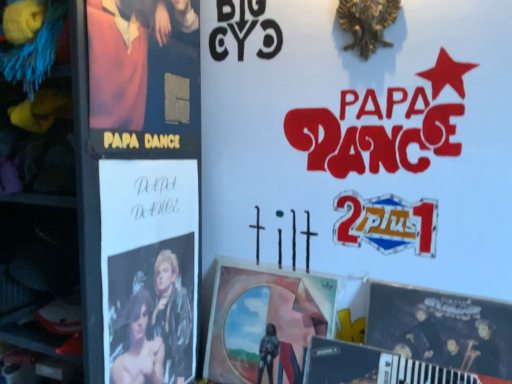
Question: In which direction should I rotate to look at matte paper poster at center, the second poster positioned from the left?

Choices:
 (A) right
 (B) left

Answer: (A)

Question: Is the depth of matte paper poster at center, the second poster positioned from the left, less than that of matte black poster at lower right, which ranks as the first poster in right-to-left order?

Choices:
 (A) no
 (B) yes

Answer: (A)

Question: Does matte paper poster at center, the second poster positioned from the left, have a greater width compared to matte black poster at lower right, which ranks as the first poster in right-to-left order?

Choices:
 (A) yes
 (B) no

Answer: (A)

Question: Could you tell me if matte paper poster at center, the 2th poster in the right-to-left sequence, is facing matte black poster at lower right, which ranks as the first poster in right-to-left order?

Choices:
 (A) no
 (B) yes

Answer: (A)

Question: Is matte black poster at lower right, which ranks as the first poster in right-to-left order, at the back of matte paper poster at center, the second poster positioned from the left?

Choices:
 (A) no
 (B) yes

Answer: (A)

Question: From the image's perspective, is matte paper poster at center, the 2th poster in the right-to-left sequence, located beneath matte black poster at lower right, which ranks as the first poster in right-to-left order?

Choices:
 (A) yes
 (B) no

Answer: (A)

Question: Would you consider matte paper poster at center, the second poster positioned from the left, to be distant from matte black poster at lower right, which is the third poster from left to right?

Choices:
 (A) no
 (B) yes

Answer: (A)

Question: From a real-world perspective, is matte paper poster at center, the second poster positioned from the left, under metallic silver magazine at lower right?

Choices:
 (A) no
 (B) yes

Answer: (A)

Question: Does matte paper poster at center, the 2th poster in the right-to-left sequence, have a lesser width compared to metallic silver magazine at lower right?

Choices:
 (A) yes
 (B) no

Answer: (B)

Question: Is matte paper poster at center, the second poster positioned from the left, taller than metallic silver magazine at lower right?

Choices:
 (A) no
 (B) yes

Answer: (B)

Question: Is matte paper poster at center, the second poster positioned from the left, positioned in front of metallic silver magazine at lower right?

Choices:
 (A) no
 (B) yes

Answer: (A)

Question: Is metallic silver magazine at lower right located within matte paper poster at center, the 2th poster in the right-to-left sequence?

Choices:
 (A) yes
 (B) no

Answer: (B)

Question: From a real-world perspective, is matte paper poster at center, the 2th poster in the right-to-left sequence, positioned over metallic silver magazine at lower right based on gravity?

Choices:
 (A) no
 (B) yes

Answer: (B)

Question: Is metallic silver magazine at lower right to the left of matte black poster at lower right, which is the third poster from left to right, from the viewer's perspective?

Choices:
 (A) yes
 (B) no

Answer: (A)